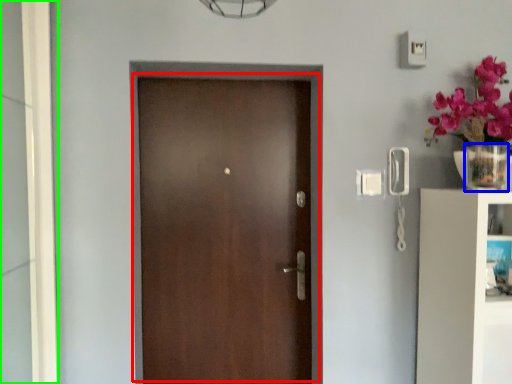
Question: Considering the real-world distances, which object is farthest from door (highlighted by a red box)? glass vase (highlighted by a blue box) or glass door (highlighted by a green box)?

Choices:
 (A) glass vase
 (B) glass door

Answer: (A)